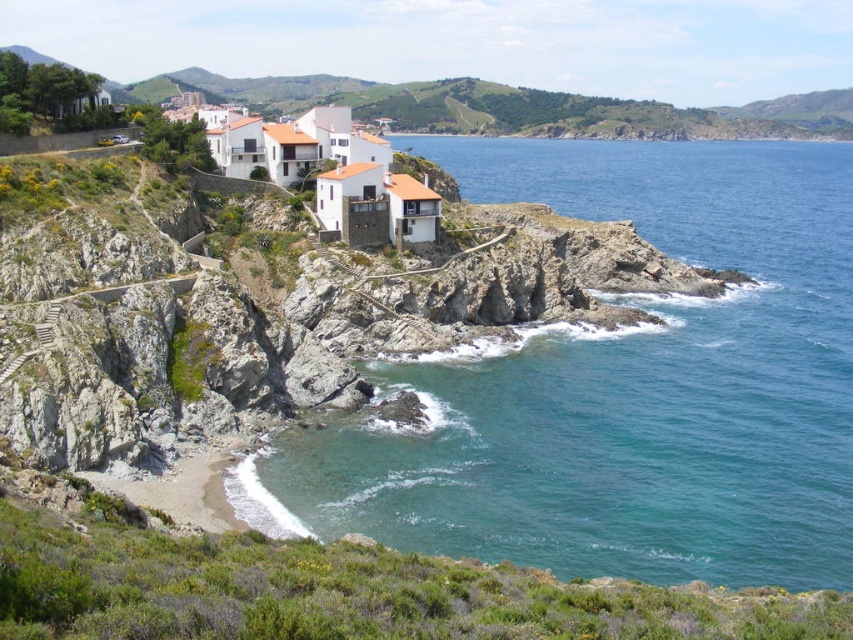
Between blue water at lower right and white matte houses at upper center, which one is positioned higher?

Positioned higher is white matte houses at upper center.

Does point (642, 572) lie behind point (409, 84)?

No, it is not.

This screenshot has height=640, width=853. Describe the element at coordinates (622, 388) in the screenshot. I see `blue water at lower right` at that location.

Locate an element on the screen. blue water at lower right is located at coordinates (622, 388).